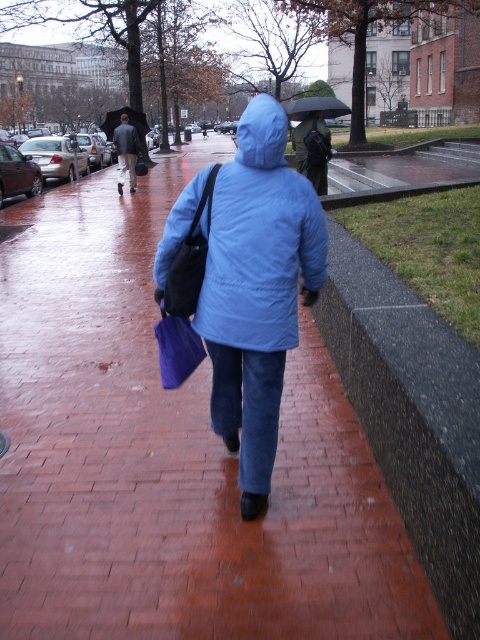
You are a pedestrian trying to cross the street safely. You notice the brick pavement at center and the matte black jacket at upper left in your view. Which object is closer to the right side of your field of view?

The brick pavement at center is positioned on the right side of matte black jacket at upper left, so it is closer to the right side of your field of view.

You are standing behind a person walking on a wet brick sidewalk in a rainy city. You notice a point at coordinates (170,456). Based on the scene, where is this point located?

The point at (170,456) is on the brick pavement at center.